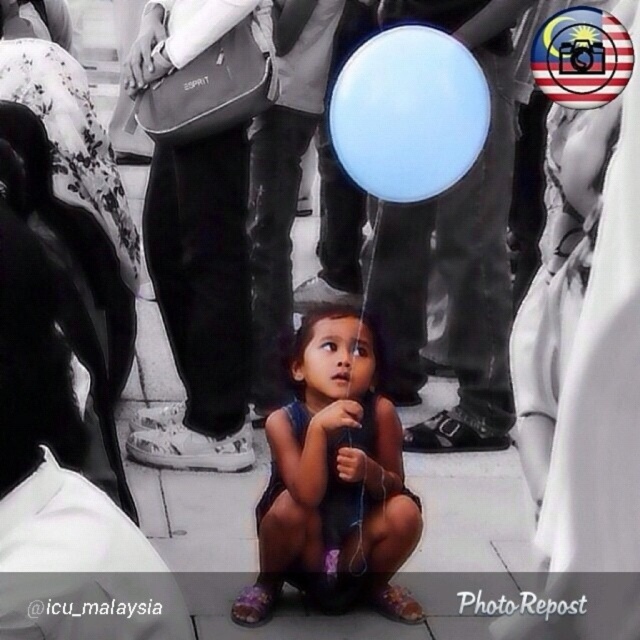
Question: Which point is farther from the camera taking this photo?

Choices:
 (A) (356, 161)
 (B) (342, 541)

Answer: (A)

Question: Does dark blue fabric dress at center have a larger size compared to blue matte balloon at upper center?

Choices:
 (A) no
 (B) yes

Answer: (B)

Question: Where is dark blue fabric dress at center located in relation to blue matte balloon at upper center in the image?

Choices:
 (A) above
 (B) below

Answer: (B)

Question: Is dark blue fabric dress at center thinner than blue matte balloon at upper center?

Choices:
 (A) yes
 (B) no

Answer: (B)

Question: Among these points, which one is farthest from the camera?

Choices:
 (A) (412, 141)
 (B) (410, 500)

Answer: (A)